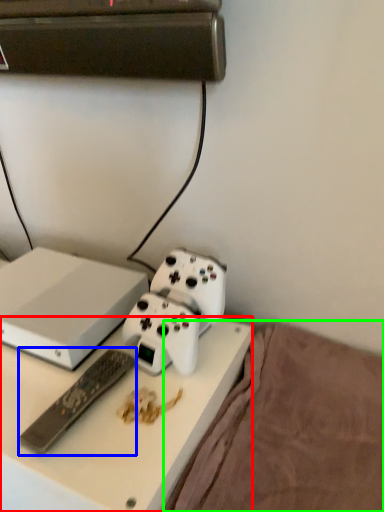
Question: Estimate the real-world distances between objects in this image. Which object is closer to desk (highlighted by a red box), remote control (highlighted by a blue box) or bedding (highlighted by a green box)?

Choices:
 (A) remote control
 (B) bedding

Answer: (A)